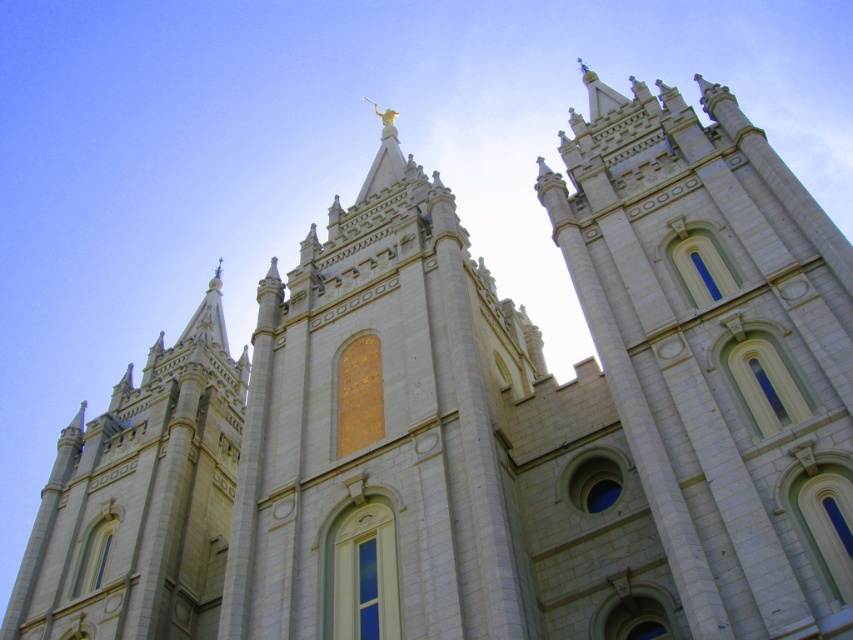
You are an architect analyzing the temple structure. You notice the white stone tower at upper center and the gold textured statue at center. Which object is located to the right of the other?

The white stone tower at upper center is positioned on the right side of gold textured statue at center.

You are an architect analyzing the temple structure. Based on the scene, which object is shorter between the white stone tower at upper center and the gold textured statue at center?

The white stone tower at upper center is shorter than the gold textured statue at center according to the description.

You are standing in front of the temple and want to take a photo of the white stone tower at upper center. The camera you have can focus on objects up to 30 meters away. Will the tower be in focus?

The white stone tower at upper center is 36.57 meters from viewer, which is beyond the camera focus range of 30 meters. The tower will not be in focus.